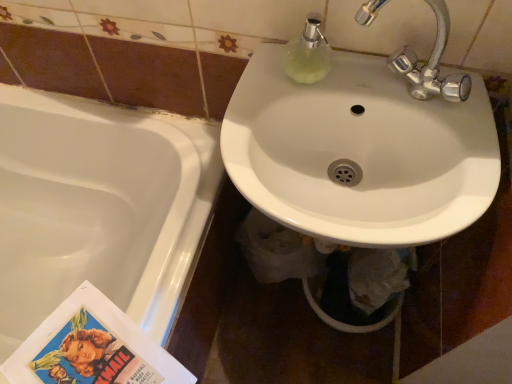
Question: Is white glossy bathtub at lower left oriented towards white glossy sink at center?

Choices:
 (A) yes
 (B) no

Answer: (B)

Question: Would you say white glossy bathtub at lower left is a long distance from white glossy sink at center?

Choices:
 (A) yes
 (B) no

Answer: (B)

Question: Can you see white glossy bathtub at lower left touching white glossy sink at center?

Choices:
 (A) no
 (B) yes

Answer: (A)

Question: Is white glossy sink at center inside white glossy bathtub at lower left?

Choices:
 (A) yes
 (B) no

Answer: (B)

Question: Is white glossy bathtub at lower left wider than white glossy sink at center?

Choices:
 (A) no
 (B) yes

Answer: (B)

Question: Can you confirm if white glossy bathtub at lower left is thinner than white glossy sink at center?

Choices:
 (A) yes
 (B) no

Answer: (B)

Question: Are translucent glass soap dispenser at upper center and white glossy sink at center located far from each other?

Choices:
 (A) no
 (B) yes

Answer: (A)

Question: Would you say translucent glass soap dispenser at upper center contains white glossy sink at center?

Choices:
 (A) no
 (B) yes

Answer: (A)

Question: From the image's perspective, would you say translucent glass soap dispenser at upper center is shown under white glossy sink at center?

Choices:
 (A) yes
 (B) no

Answer: (B)

Question: Is translucent glass soap dispenser at upper center at the left side of white glossy sink at center?

Choices:
 (A) no
 (B) yes

Answer: (B)

Question: From the image's perspective, is translucent glass soap dispenser at upper center above white glossy sink at center?

Choices:
 (A) yes
 (B) no

Answer: (A)

Question: Is translucent glass soap dispenser at upper center thinner than white glossy sink at center?

Choices:
 (A) no
 (B) yes

Answer: (B)

Question: From a real-world perspective, is white glossy sink at center physically above white glossy bathtub at lower left?

Choices:
 (A) no
 (B) yes

Answer: (B)